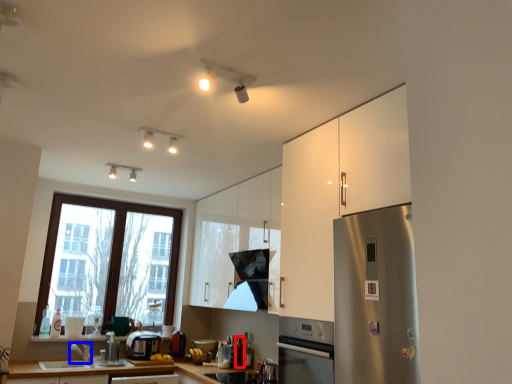
Question: Which object is further to the camera taking this photo, bottle (highlighted by a red box) or faucet (highlighted by a blue box)?

Choices:
 (A) bottle
 (B) faucet

Answer: (A)